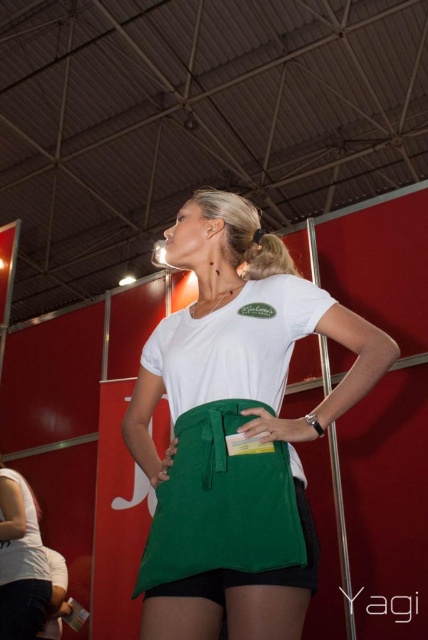
Is white fabric shirt at center positioned behind white matte t-shirt at center?

No.

Which is in front, point (275, 605) or point (23, 499)?

Point (275, 605) is more forward.

The height and width of the screenshot is (640, 428). What are the coordinates of `white fabric shirt at center` in the screenshot? It's located at (211, 246).

Does white fabric shirt at center have a greater height compared to shiny brown hair at upper center?

Yes.

Does white fabric shirt at center appear under shiny brown hair at upper center?

Correct, white fabric shirt at center is located below shiny brown hair at upper center.

I want to click on white fabric shirt at center, so click(x=211, y=246).

You are a GUI agent. You are given a task and a screenshot of the screen. Output one action in this format:
    pyautogui.click(x=<x>, y=<y>)
    Task: Click on the white fabric shirt at center
    This screenshot has height=640, width=428.
    Given the screenshot: What is the action you would take?
    pyautogui.click(x=211, y=246)

Does white matte t-shirt at center have a lesser width compared to shiny brown hair at upper center?

Incorrect, white matte t-shirt at center's width is not less than shiny brown hair at upper center's.

Where is `white matte t-shirt at center`? The height and width of the screenshot is (640, 428). white matte t-shirt at center is located at coordinates (20, 561).